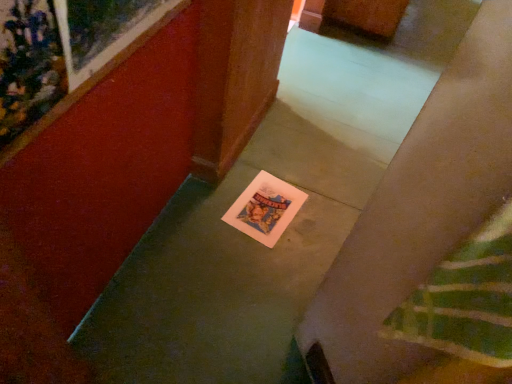
What are the coordinates of `vacant point to the right of white paper postcard at center` in the screenshot? It's located at point(314,225).